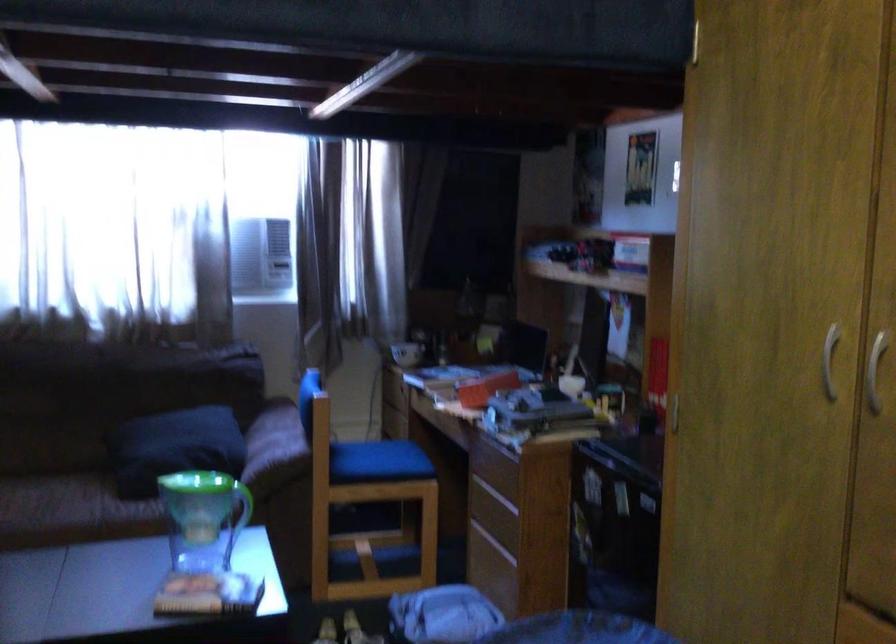
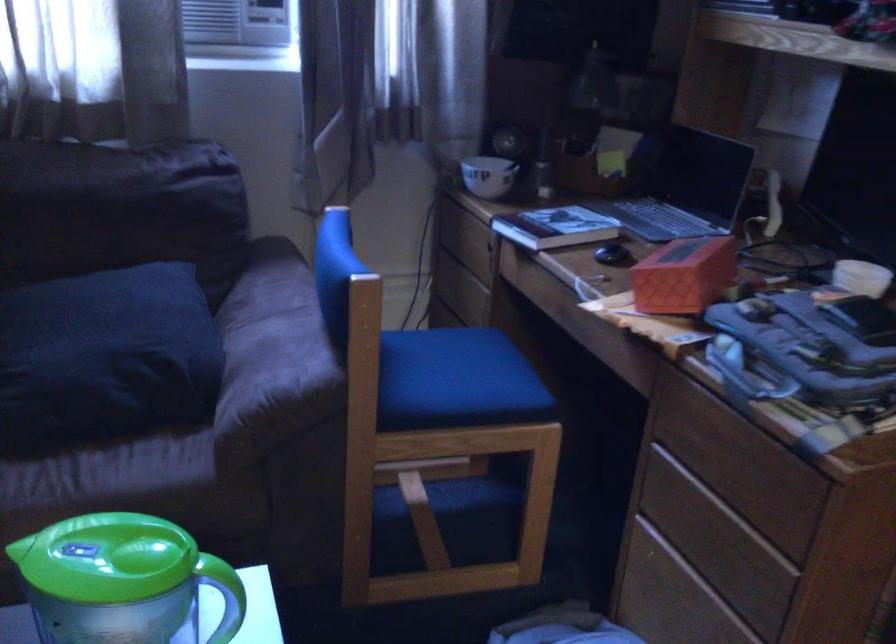
Find the pixel in the second image that matches pixel 481 384 in the first image.

(684, 275)